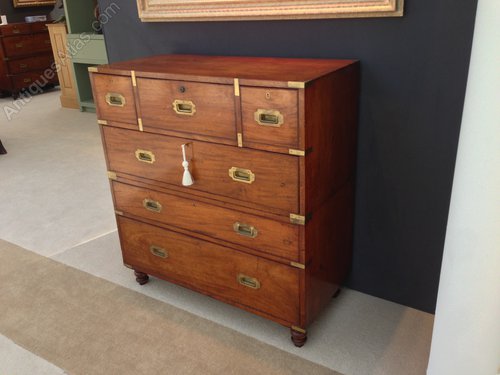
In order to click on handle in this screenshot , I will do `click(116, 101)`.